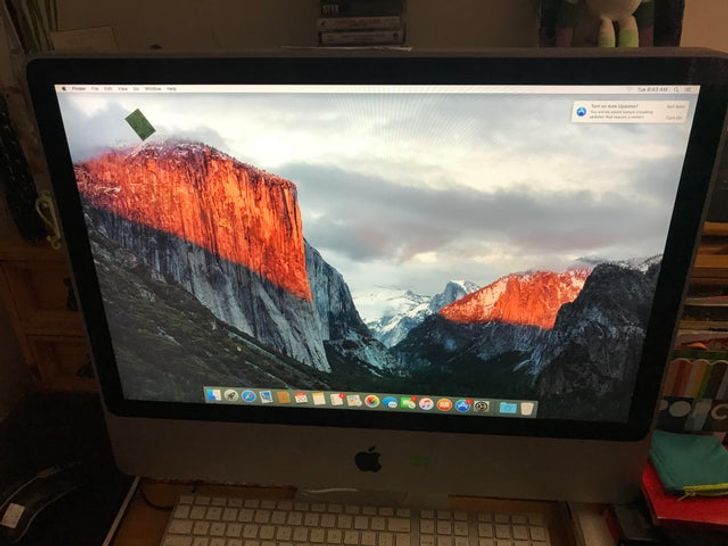
Where is `monitor screen`? This screenshot has width=728, height=546. monitor screen is located at coordinates (494, 169).